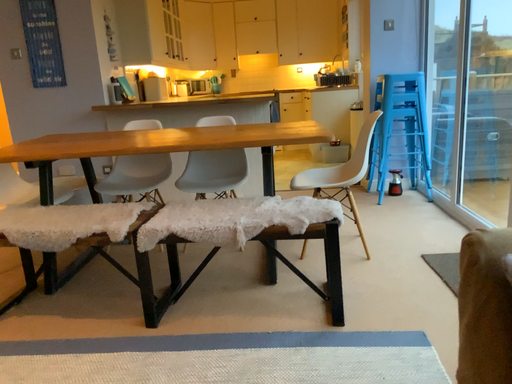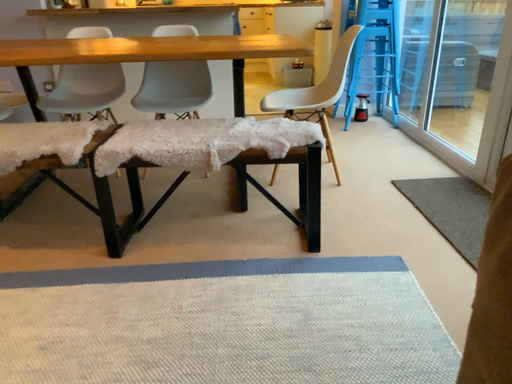
Question: How did the camera likely rotate when shooting the video?

Choices:
 (A) rotated right
 (B) rotated left

Answer: (A)